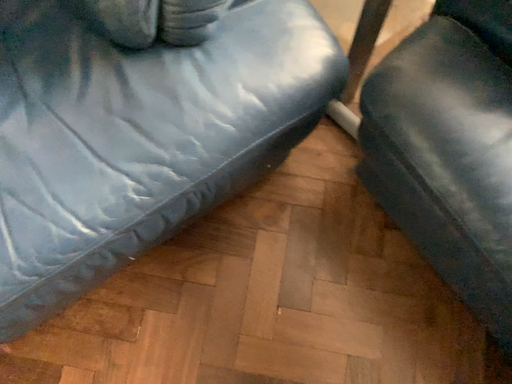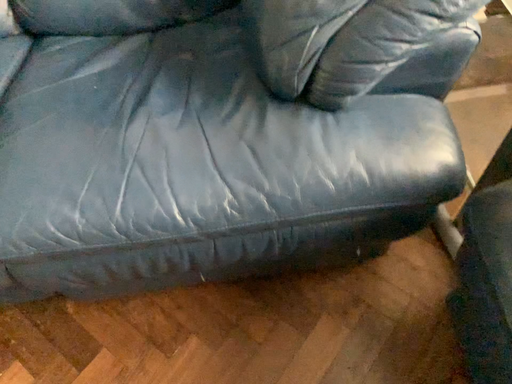
Question: How did the camera likely rotate when shooting the video?

Choices:
 (A) rotated right
 (B) rotated left

Answer: (B)